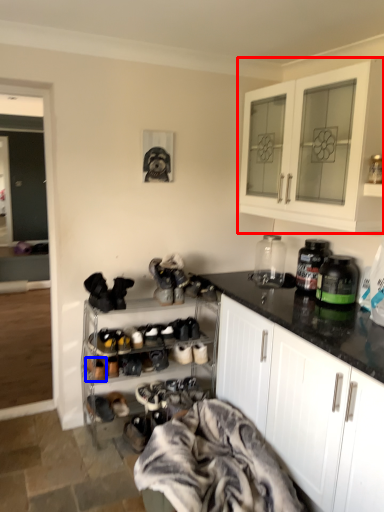
Question: Among these objects, which one is nearest to the camera, cabinetry (highlighted by a red box) or shoe (highlighted by a blue box)?

Choices:
 (A) cabinetry
 (B) shoe

Answer: (A)